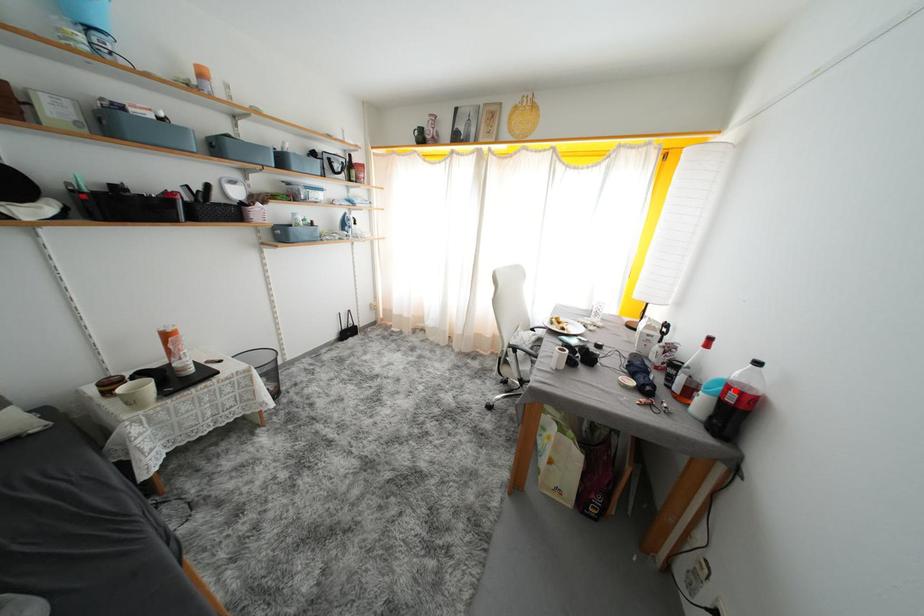
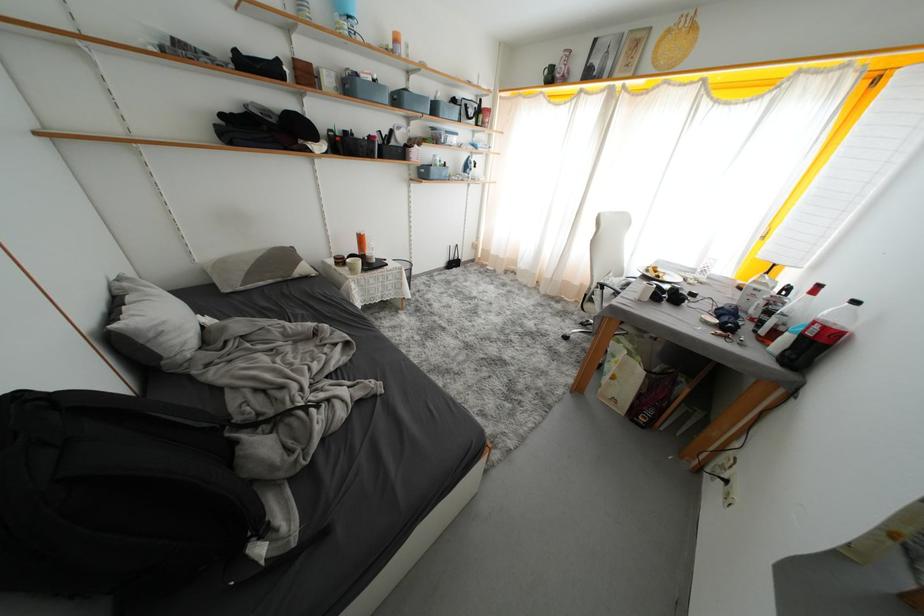
Where in the second image is the point corresponding to the highlighted location from the first image?

(821, 328)